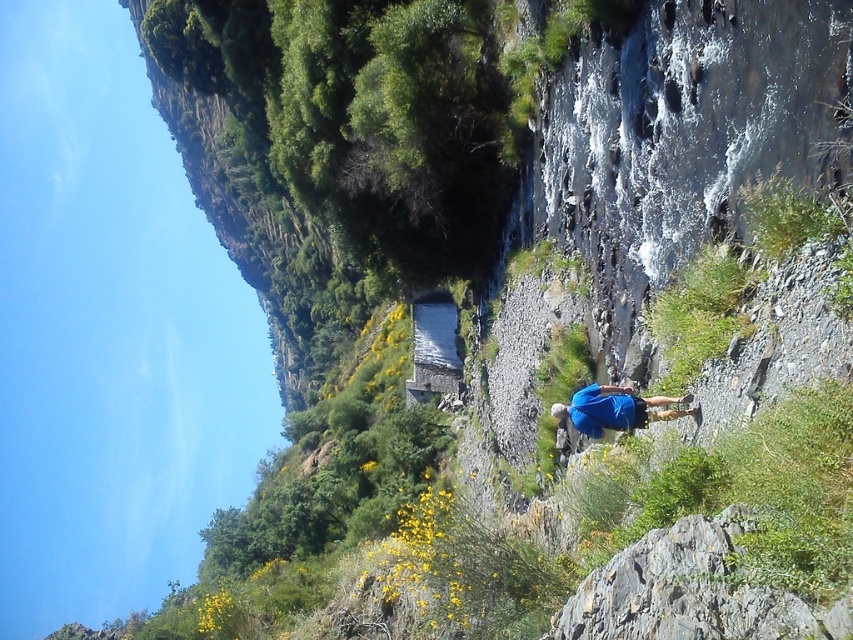
At what (x,y) coordinates should I click in order to perform the action: click on gray rough rock at lower right. Please return your answer as a coordinate pair (x, y). Looking at the image, I should click on (689, 592).

Does gray rough rock at lower right have a larger size compared to blue fabric shirt at center?

Yes, gray rough rock at lower right is bigger than blue fabric shirt at center.

Which is in front, point (695, 576) or point (592, 404)?

Positioned in front is point (695, 576).

This screenshot has height=640, width=853. Identify the location of gray rough rock at lower right. (689, 592).